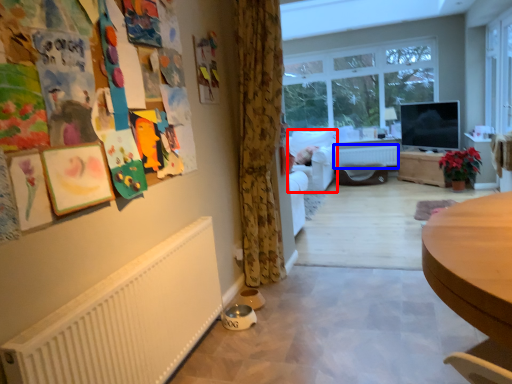
Question: Which of the following is the farthest to the observer, armchair (highlighted by a red box) or radiator (highlighted by a blue box)?

Choices:
 (A) armchair
 (B) radiator

Answer: (B)